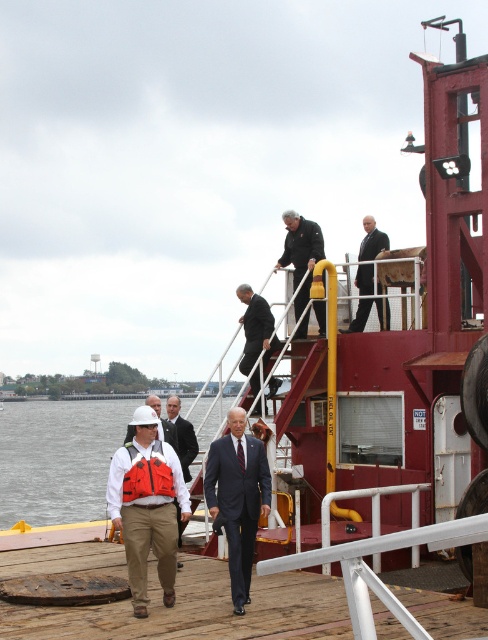
You are a photographer standing on the dock. You see the dark blue suit at center and the white matte helmet at center. Which one appears taller from your viewpoint?

The dark blue suit at center appears taller than the white matte helmet at center from your viewpoint.

You are a safety inspector on the dock and need to ensure that the dark blue suit at center is at least 3 meters away from the brown wooden deck at lower center for safety regulations. Based on the scene, is the current distance compliant with the requirement?

The brown wooden deck at lower center and dark blue suit at center are 2.89 meters apart, which is less than the required 3 meters. Therefore, the current distance does not comply with the safety regulations.